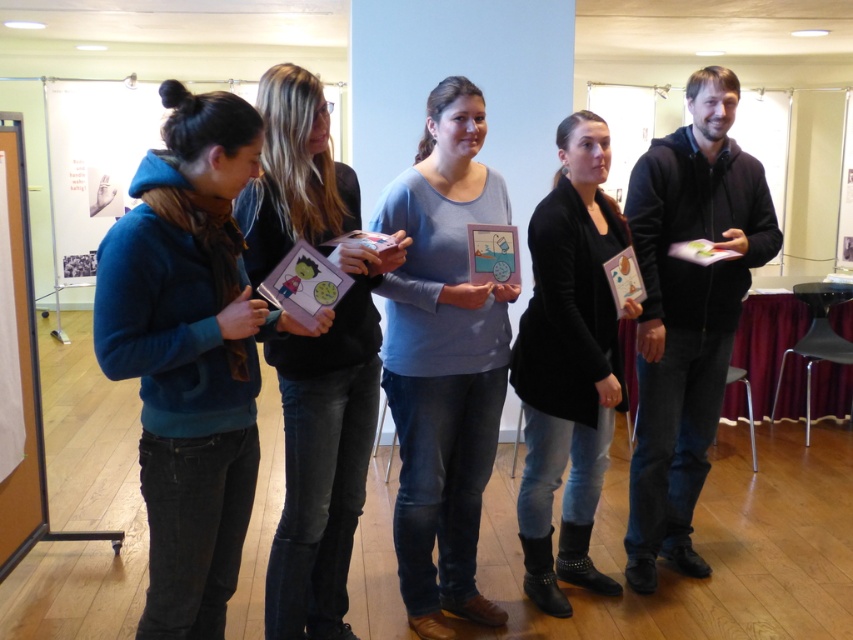
Question: Which of the following is the farthest from the observer?

Choices:
 (A) (305, 493)
 (B) (170, 465)
 (C) (595, 481)
 (D) (453, 401)

Answer: (C)

Question: In this image, where is teal fleece jacket at left located relative to matte black card at center?

Choices:
 (A) above
 (B) below

Answer: (B)

Question: Among these points, which one is farthest from the camera?

Choices:
 (A) (321, 461)
 (B) (204, 621)
 (C) (589, 518)
 (D) (457, 468)

Answer: (C)

Question: Can you confirm if matte black card at center is positioned below black leather jacket at center?

Choices:
 (A) no
 (B) yes

Answer: (A)

Question: Is teal fleece jacket at left further to the viewer compared to black leather jacket at center?

Choices:
 (A) no
 (B) yes

Answer: (A)

Question: Which of the following is the farthest from the observer?

Choices:
 (A) (375, 312)
 (B) (538, 209)
 (C) (459, 586)
 (D) (178, 344)

Answer: (C)